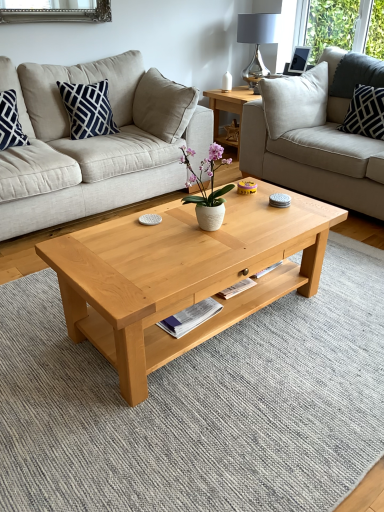
Identify the location of vacant area to the left of white ceramic vase at center. (160, 233).